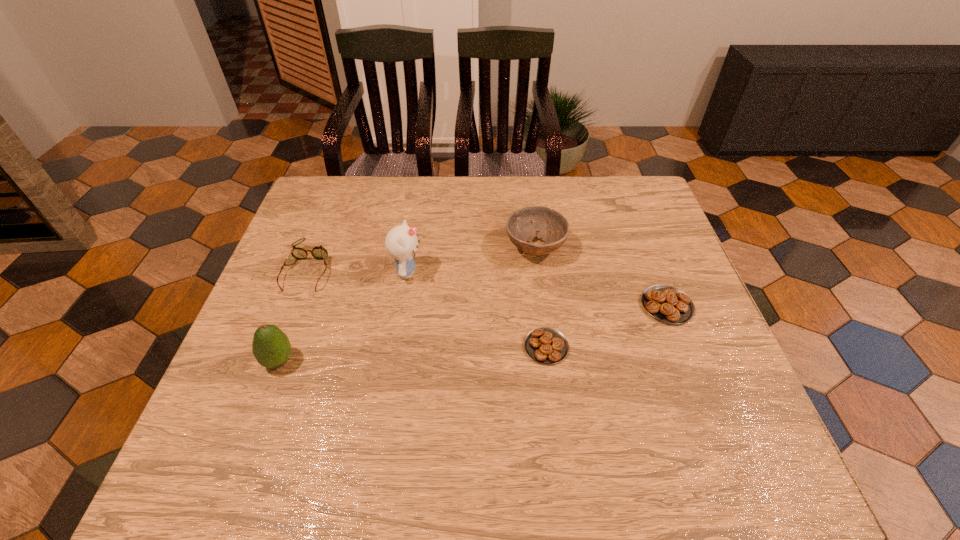
Given the evenly spaced pastrys in the image, where should an extra pastry be added on the left to preserve the spacing? Please point to a vacant space. Please provide its 2D coordinates. Your answer should be formatted as a tuple, i.e. [(x, y)], where the tuple contains the x and y coordinates of a point satisfying the conditions above.

[(403, 395)]